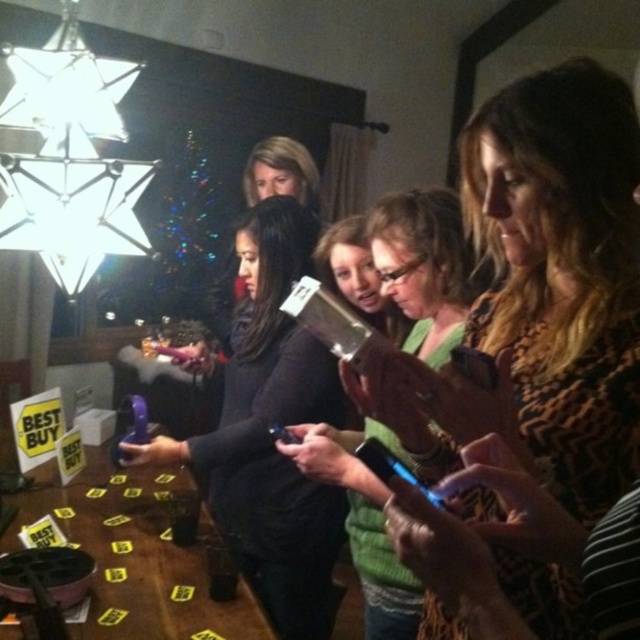
Question: Is leopard print scarf at center closer to camera compared to yellow paper placards at lower left?

Choices:
 (A) yes
 (B) no

Answer: (A)

Question: Does matte black phone at center have a smaller size compared to green knitted sweater at center?

Choices:
 (A) yes
 (B) no

Answer: (B)

Question: Which of these objects is positioned closest to the yellow paper placards at lower left?

Choices:
 (A) green knitted sweater at center
 (B) leopard print scarf at center

Answer: (A)

Question: Is matte black phone at center bigger than green knitted sweater at center?

Choices:
 (A) no
 (B) yes

Answer: (B)

Question: Which of the following is the closest to the observer?

Choices:
 (A) (x=516, y=333)
 (B) (x=352, y=516)
 (C) (x=138, y=579)
 (D) (x=262, y=596)

Answer: (A)

Question: Considering the real-world distances, which object is closest to the yellow paper placards at lower left?

Choices:
 (A) green knitted sweater at center
 (B) matte black phone at center

Answer: (B)